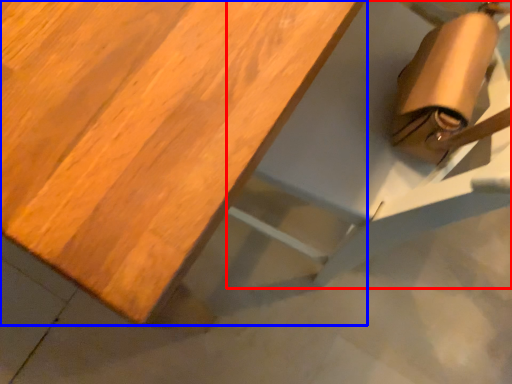
Question: Which point is closer to the camera, chair (highlighted by a red box) or table (highlighted by a blue box)?

Choices:
 (A) chair
 (B) table

Answer: (B)